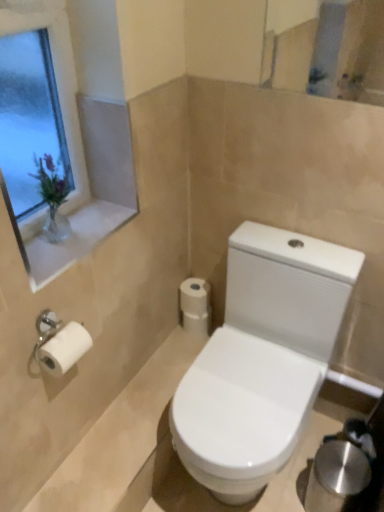
What do you see at coordinates (29, 118) in the screenshot?
I see `clear glass vase at upper left` at bounding box center [29, 118].

Measure the distance between white glossy toilet at lower center and camera.

white glossy toilet at lower center and camera are 1.17 meters apart.

What do you see at coordinates (195, 305) in the screenshot?
I see `white matte toilet paper at center` at bounding box center [195, 305].

The height and width of the screenshot is (512, 384). In order to click on white glossy window sill at upper left in this screenshot , I will do `click(73, 240)`.

Are white glossy toilet at lower center and white matte toilet paper at center located far from each other?

No, there isn't a large distance between white glossy toilet at lower center and white matte toilet paper at center.

Who is smaller, white glossy toilet at lower center or white matte toilet paper at center?

white matte toilet paper at center is smaller.

From the image's perspective, is white glossy toilet at lower center on top of white matte toilet paper at center?

No, from the image's perspective, white glossy toilet at lower center is not over white matte toilet paper at center.

Can you confirm if white glossy window sill at upper left is shorter than clear glass vase at upper left?

Yes, white glossy window sill at upper left is shorter than clear glass vase at upper left.

From the picture: Would you say white glossy window sill at upper left is outside clear glass vase at upper left?

white glossy window sill at upper left is positioned outside clear glass vase at upper left.

This screenshot has height=512, width=384. What are the coordinates of `window sill lying behind the clear glass vase at upper left` in the screenshot? It's located at (73, 240).

Is white glossy window sill at upper left positioned with its back to clear glass vase at upper left?

No, white glossy window sill at upper left is not facing away from clear glass vase at upper left.

Could you tell me if clear glass vase at upper left is turned towards white glossy window sill at upper left?

Yes, clear glass vase at upper left is oriented towards white glossy window sill at upper left.

Consider the image. Which of these two, clear glass vase at upper left or white glossy window sill at upper left, is thinner?

Thinner between the two is clear glass vase at upper left.

From the image's perspective, would you say clear glass vase at upper left is shown under white glossy window sill at upper left?

No, from the image's perspective, clear glass vase at upper left is not beneath white glossy window sill at upper left.

Considering the points (32, 119) and (70, 264), which point is in front, point (32, 119) or point (70, 264)?

The point (70, 264) is closer.

From a real-world perspective, which object stands above the other?

clear glass vase at upper left.

Looking at this image, is white matte toilet paper at center in front of clear glass vase at upper left?

No, it is not.

Are white matte toilet paper at center and clear glass vase at upper left located far from each other?

white matte toilet paper at center is actually quite close to clear glass vase at upper left.

Considering the positions of points (206, 315) and (67, 157), is point (206, 315) farther from camera compared to point (67, 157)?

Yes, point (206, 315) is farther from viewer.

Does white glossy toilet at lower center appear on the right side of clear glass vase at upper left?

Yes.

Based on the photo, from the image's perspective, is white glossy toilet at lower center beneath clear glass vase at upper left?

Yes, from the image's perspective, white glossy toilet at lower center is below clear glass vase at upper left.

Can you confirm if white glossy toilet at lower center is smaller than clear glass vase at upper left?

Yes.

Considering the relative sizes of white glossy toilet at lower center and clear glass vase at upper left in the image provided, is white glossy toilet at lower center thinner than clear glass vase at upper left?

Incorrect, the width of white glossy toilet at lower center is not less than that of clear glass vase at upper left.

From the image's perspective, is white glossy window sill at upper left over white glossy toilet at lower center?

Yes.

Which of these two, white glossy window sill at upper left or white glossy toilet at lower center, stands shorter?

white glossy window sill at upper left.

In the scene shown: Can you tell me how much white glossy window sill at upper left and white glossy toilet at lower center differ in facing direction?

The angle between the facing direction of white glossy window sill at upper left and the facing direction of white glossy toilet at lower center is 2.2e-05 degrees.

Does clear glass vase at upper left have a lesser height compared to white matte toilet paper at center?

No.

Does clear glass vase at upper left touch white matte toilet paper at center?

No, clear glass vase at upper left is not in contact with white matte toilet paper at center.

This screenshot has height=512, width=384. Find the location of `bath on the left of the white matte toilet paper at center`. bath on the left of the white matte toilet paper at center is located at coordinates (119, 435).

Where is `window screen that appears above the white glossy window sill at upper left (from the image's perspective)`? The height and width of the screenshot is (512, 384). window screen that appears above the white glossy window sill at upper left (from the image's perspective) is located at coordinates (29, 118).

When comparing their distances from white glossy window sill at upper left, does white glossy toilet at lower center or clear glass vase at upper left seem closer?

The object closer to white glossy window sill at upper left is clear glass vase at upper left.

Estimate the real-world distances between objects in this image. Which object is further from white glossy toilet at lower center, white glossy window sill at upper left or clear glass vase at upper left?

clear glass vase at upper left lies further to white glossy toilet at lower center than the other object.

When comparing their distances from white glossy toilet at lower center, does clear glass vase at upper left or white glossy window sill at upper left seem further?

clear glass vase at upper left is further to white glossy toilet at lower center.

From the image, which object appears to be farther from white glossy toilet at lower center, white matte toilet paper at center or clear glass vase at upper left?

clear glass vase at upper left is further to white glossy toilet at lower center.

Looking at the image, which one is located closer to white matte toilet paper at center, white glossy toilet at lower center or clear glass vase at upper left?

white glossy toilet at lower center.

From the image, which object appears to be farther from clear glass vase at upper left, white matte toilet paper at center or white glossy window sill at upper left?

white matte toilet paper at center lies further to clear glass vase at upper left than the other object.

Based on their spatial positions, is white matte toilet paper at center or white glossy toilet at lower center further from white glossy window sill at upper left?

Among the two, white glossy toilet at lower center is located further to white glossy window sill at upper left.

Which object lies nearer to the anchor point white glossy toilet at lower center, clear glass vase at upper left or white matte toilet paper at center?

white matte toilet paper at center.

This screenshot has height=512, width=384. I want to click on window sill that lies between clear glass vase at upper left and white glossy toilet at lower center from top to bottom, so click(x=73, y=240).

Identify the location of window sill located between clear glass vase at upper left and white matte toilet paper at center in the depth direction. (73, 240).

You are a GUI agent. You are given a task and a screenshot of the screen. Output one action in this format:
    pyautogui.click(x=<x>, y=<y>)
    Task: Click on the bath between white glossy window sill at upper left and white matte toilet paper at center in the front-back direction
    Image resolution: width=384 pixels, height=512 pixels.
    Given the screenshot: What is the action you would take?
    pyautogui.click(x=119, y=435)

In order to click on toilet paper between clear glass vase at upper left and white glossy toilet at lower center from top to bottom in this screenshot , I will do `click(195, 305)`.